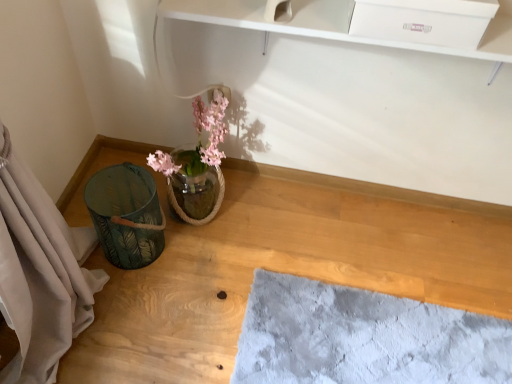
Locate an element on the screen. This screenshot has width=512, height=384. empty space that is ontop of green fabric basket at lower left is located at coordinates (282, 307).